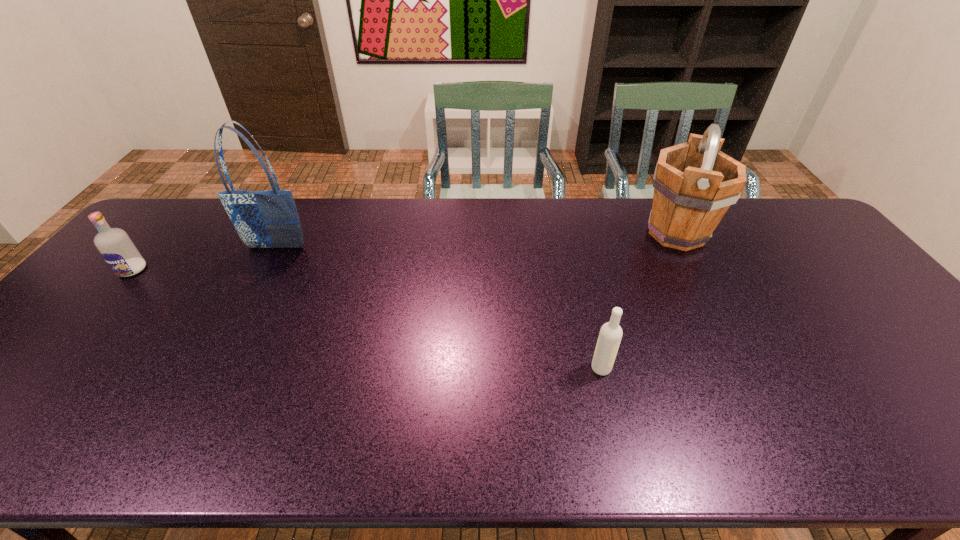
Where is `free space that satisfies the following two spatial constraints: 1. on the label of the leftmost object; 2. on the left side of the nearest object`? The height and width of the screenshot is (540, 960). free space that satisfies the following two spatial constraints: 1. on the label of the leftmost object; 2. on the left side of the nearest object is located at coordinates (47, 368).

The width and height of the screenshot is (960, 540). Find the location of `vacant space that satisfies the following two spatial constraints: 1. on the front-facing side of the third object from right to left; 2. on the right side of the third object from left to right`. vacant space that satisfies the following two spatial constraints: 1. on the front-facing side of the third object from right to left; 2. on the right side of the third object from left to right is located at coordinates (211, 368).